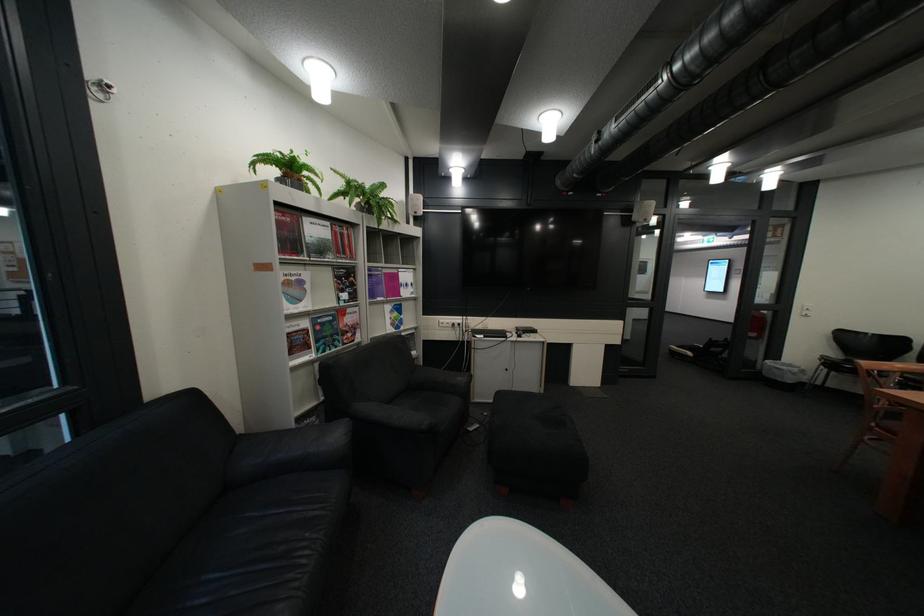
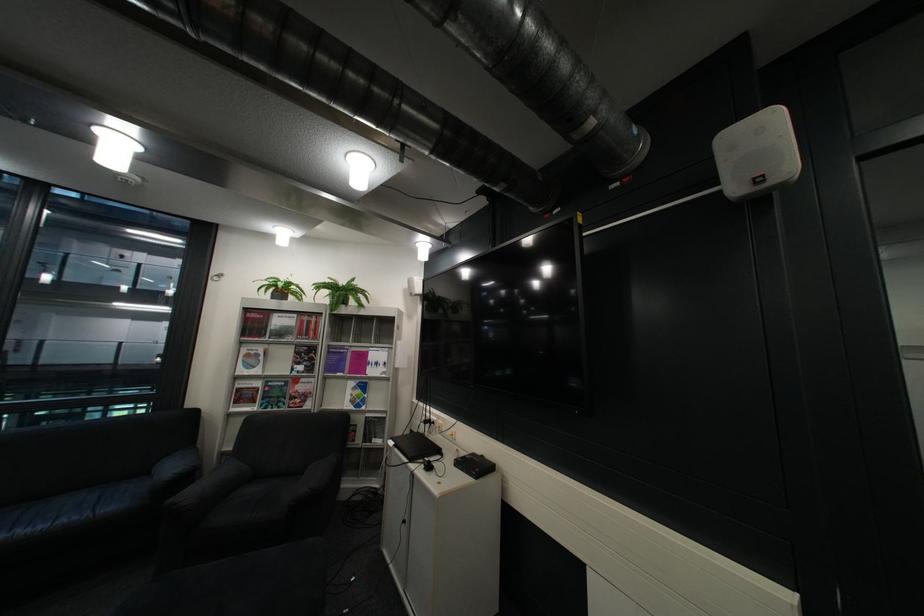
Find the pixel in the second image that matches pixel 429 353 in the first image.

(393, 442)